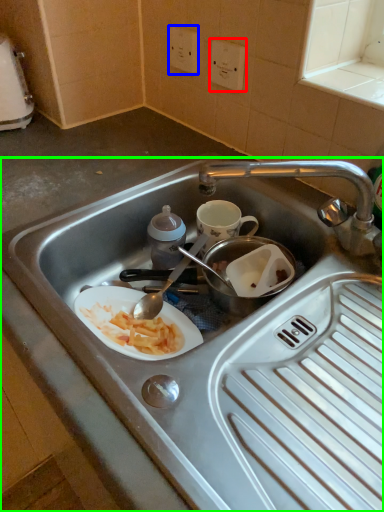
Question: Which object is positioned farthest from electric outlet (highlighted by a red box)? Select from electric outlet (highlighted by a blue box) and sink (highlighted by a green box).

Choices:
 (A) electric outlet
 (B) sink

Answer: (B)